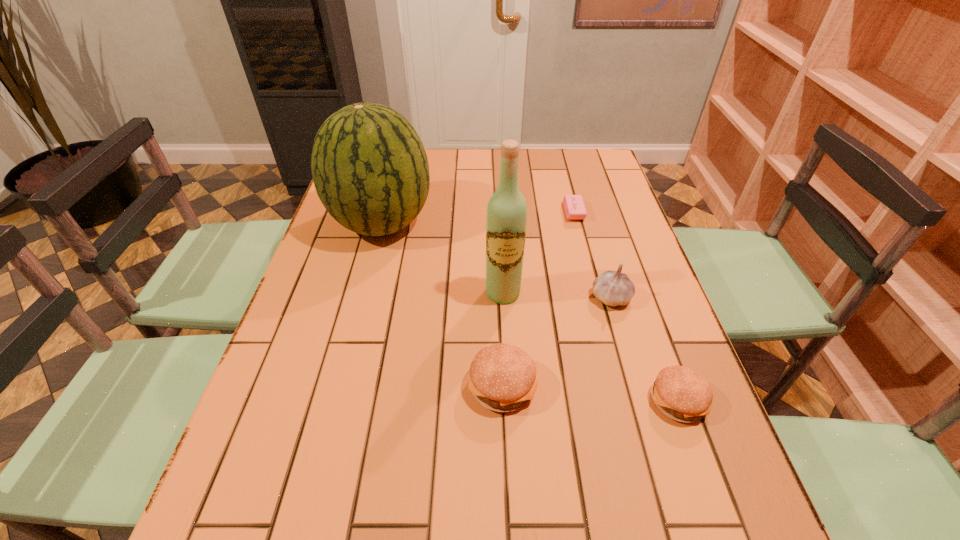
Find the location of `vacant space at the near edge`. vacant space at the near edge is located at coordinates (365, 470).

Identify the location of vacant space at the left edge of the desktop. (348, 336).

Locate an element on the screen. vacant position at the right edge of the desktop is located at coordinates (619, 243).

The height and width of the screenshot is (540, 960). What are the coordinates of `vacant region at the near left corner of the desktop` in the screenshot? It's located at (231, 477).

Locate an element on the screen. free space between the taller hamburger and the wine bottle is located at coordinates (503, 339).

Locate an element on the screen. This screenshot has width=960, height=540. free space between the third shortest object and the shorter hamburger is located at coordinates (589, 393).

What are the coordinates of `free space between the eraser and the wine bottle` in the screenshot? It's located at (539, 253).

In order to click on free space between the right hamburger and the leftmost object in this screenshot , I will do `click(530, 312)`.

The image size is (960, 540). I want to click on free space between the second tallest object and the second shortest object, so click(x=530, y=312).

You are a GUI agent. You are given a task and a screenshot of the screen. Output one action in this format:
    pyautogui.click(x=<x>, y=<y>)
    Task: Click on the free space between the right hamburger and the left hamburger
    
    Given the screenshot: What is the action you would take?
    pyautogui.click(x=589, y=393)